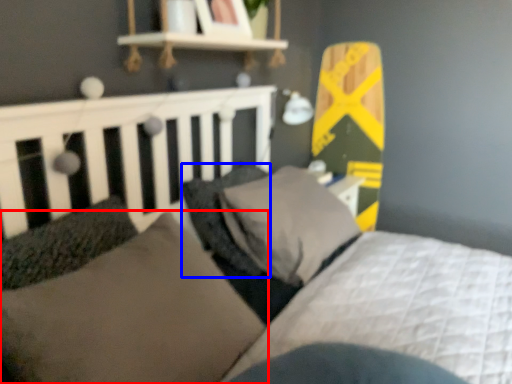
Question: Which of the following is the closest to the observer, pillow (highlighted by a red box) or pillow (highlighted by a blue box)?

Choices:
 (A) pillow
 (B) pillow

Answer: (A)